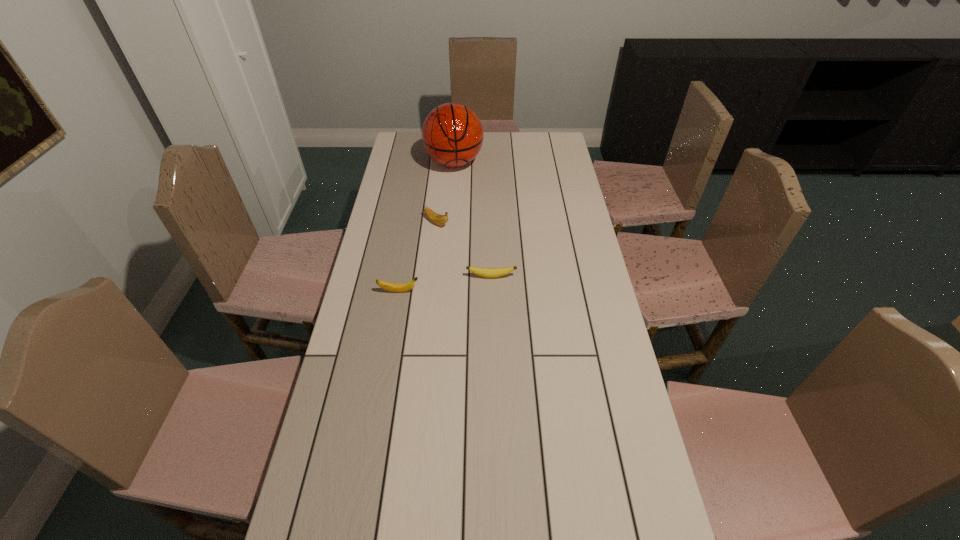
Identify the location of basketball. This screenshot has width=960, height=540. (452, 134).

Locate an element on the screen. The width and height of the screenshot is (960, 540). the farthest object is located at coordinates (452, 134).

Where is `the third nearest object`? the third nearest object is located at coordinates (438, 219).

Locate an element on the screen. Image resolution: width=960 pixels, height=540 pixels. the nearest banana is located at coordinates (392, 287).

Identify the location of the shortest banana. The height and width of the screenshot is (540, 960). (485, 272).

This screenshot has height=540, width=960. Find the location of `the second farthest banana`. the second farthest banana is located at coordinates (485, 272).

This screenshot has height=540, width=960. What are the coordinates of `free region located 0.390m on the side with spill of the tallest object` in the screenshot? It's located at (448, 239).

Identify the location of free space located 0.180m on the left of the second farthest object. The width and height of the screenshot is (960, 540). (376, 222).

What are the coordinates of `free space located 0.270m at the stem of the nearest object` in the screenshot? It's located at (503, 292).

Image resolution: width=960 pixels, height=540 pixels. Identify the location of free location located 0.320m on the front of the second nearest banana. (493, 361).